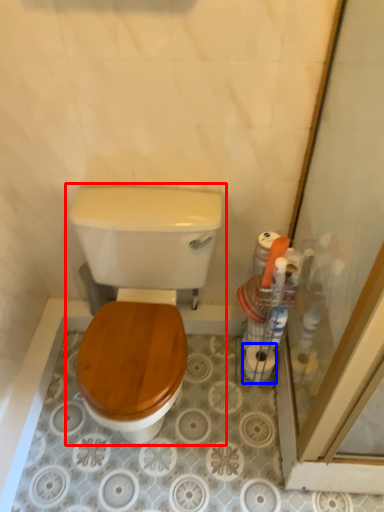
Question: Which point is closer to the camera, toilet (highlighted by a red box) or toilet paper (highlighted by a blue box)?

Choices:
 (A) toilet
 (B) toilet paper

Answer: (A)